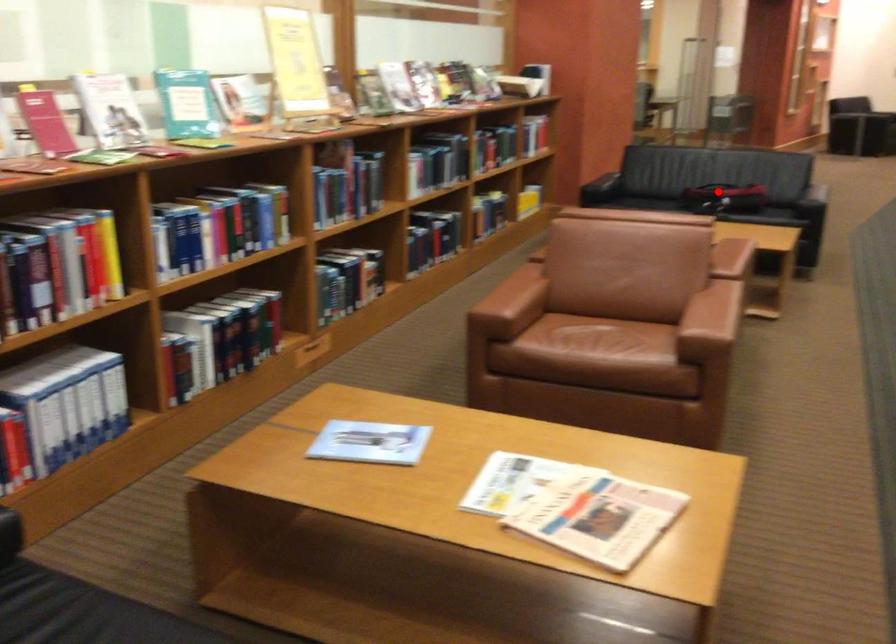
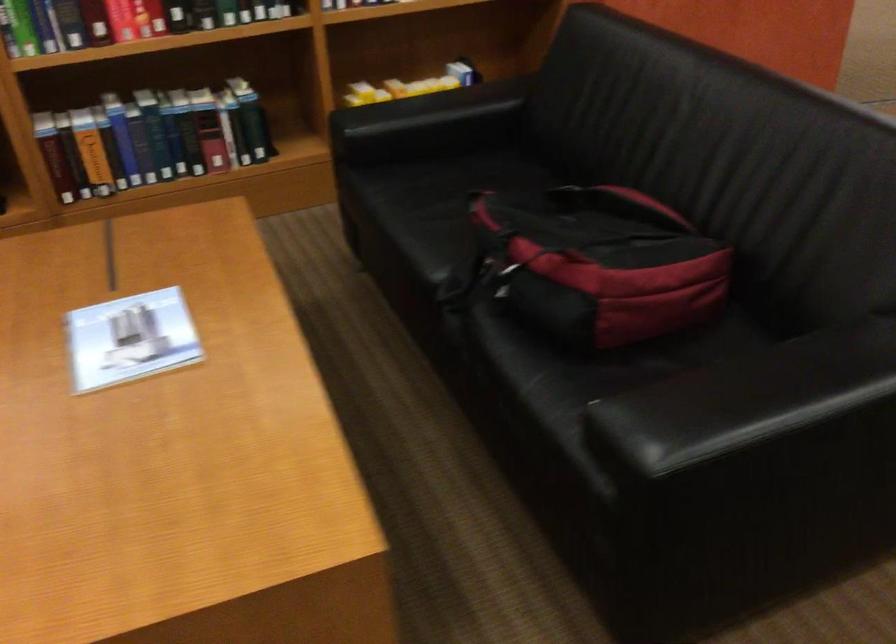
Where in the second image is the point corresponding to the highlighted location from the first image?

(495, 269)